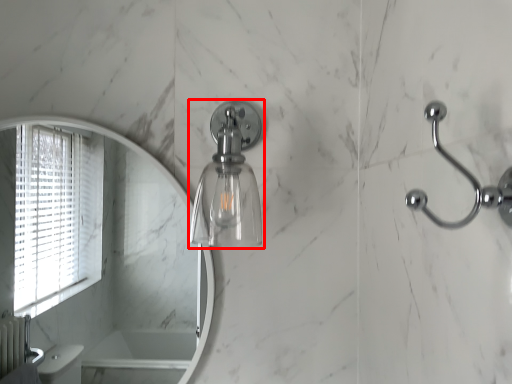
Question: From the image's perspective, where is soap dispenser (annotated by the red box) located relative to door handle?

Choices:
 (A) below
 (B) above

Answer: (B)